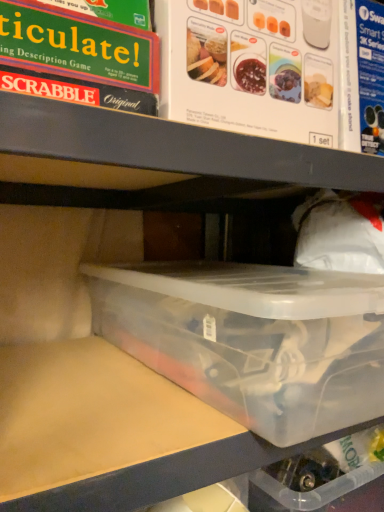
Question: Is clear plastic container at center smaller than transparent plastic container at center?

Choices:
 (A) no
 (B) yes

Answer: (A)

Question: Can you confirm if clear plastic container at center is shorter than transparent plastic container at center?

Choices:
 (A) no
 (B) yes

Answer: (A)

Question: Does clear plastic container at center have a lesser width compared to transparent plastic container at center?

Choices:
 (A) yes
 (B) no

Answer: (A)

Question: Is the position of clear plastic container at center less distant than that of transparent plastic container at center?

Choices:
 (A) yes
 (B) no

Answer: (B)

Question: Is clear plastic container at center positioned beyond the bounds of transparent plastic container at center?

Choices:
 (A) no
 (B) yes

Answer: (B)

Question: From a real-world perspective, is clear plastic container at center located higher than transparent plastic container at center?

Choices:
 (A) yes
 (B) no

Answer: (A)

Question: Is transparent plastic container at center positioned with its back to clear plastic container at center?

Choices:
 (A) no
 (B) yes

Answer: (A)

Question: Is transparent plastic container at center in contact with clear plastic container at center?

Choices:
 (A) yes
 (B) no

Answer: (B)

Question: Is transparent plastic container at center shorter than clear plastic container at center?

Choices:
 (A) no
 (B) yes

Answer: (B)

Question: Does transparent plastic container at center appear on the right side of clear plastic container at center?

Choices:
 (A) yes
 (B) no

Answer: (A)

Question: Considering the relative sizes of transparent plastic container at center and clear plastic container at center in the image provided, is transparent plastic container at center taller than clear plastic container at center?

Choices:
 (A) no
 (B) yes

Answer: (A)

Question: From the image's perspective, would you say transparent plastic container at center is shown under clear plastic container at center?

Choices:
 (A) no
 (B) yes

Answer: (B)

Question: Is point (291, 278) closer or farther from the camera than point (84, 134)?

Choices:
 (A) farther
 (B) closer

Answer: (A)